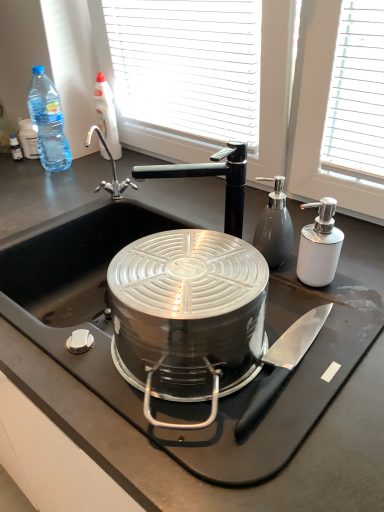
At what (x,y) coordinates should I click in order to perform the action: click on vacant area that is in front of polished stainless steel knife at lower center. Please return your answer as a coordinate pair (x, y). Looking at the image, I should click on (278, 431).